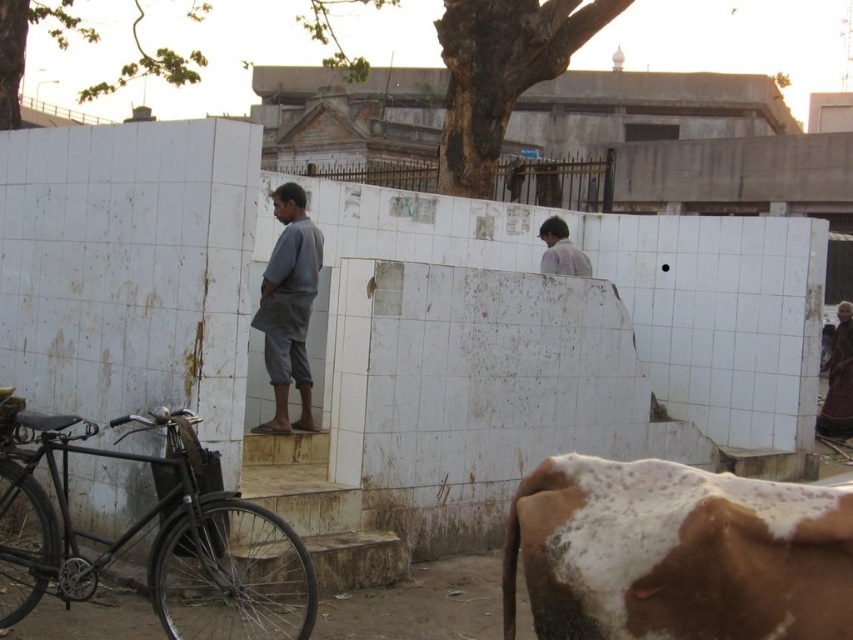
You are a delivery person trying to place a package between the brown speckled hide at lower right and the black matte bicycle at left. Can you fit the package between them if the package is 20 cm thick?

The brown speckled hide at lower right is thinner than the black matte bicycle at left. Since the package is 20 cm thick, it depends on the minimum space between them. However, the description only states the hide is thinner, not the exact dimensions. Without specific measurements, we cannot confirm if the package will fit.

You are standing at the point marked by the coordinates point [154,536]. Looking around, you see a man on small concrete steps next to a weathered tiled wall. To your right, there is a black matte bicycle at left. Which direction should you walk to reach the black matte bicycle at left?

The black matte bicycle at left is located to your right, so you should walk to your right to reach it.